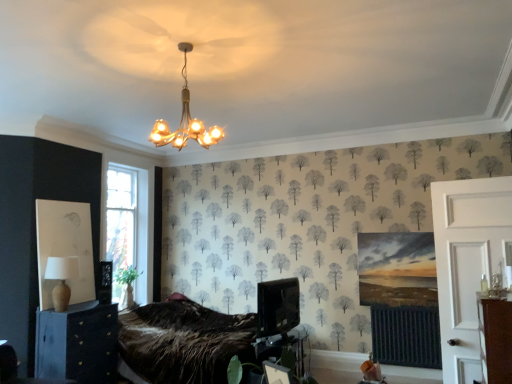
Locate an element on the screen. This screenshot has height=384, width=512. free space above gold metallic chandelier at upper center (from a real-world perspective) is located at coordinates (182, 48).